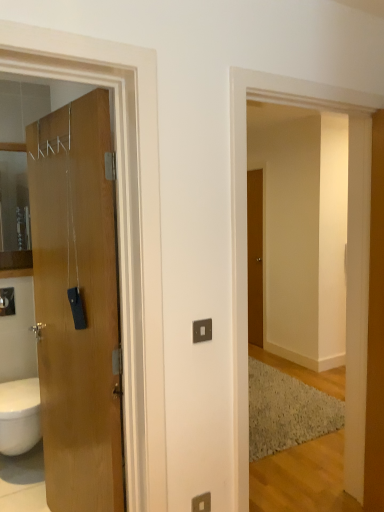
Question: Would you say wooden pillar at right contains wooden door at left, marked as the second door in a back-to-front arrangement?

Choices:
 (A) no
 (B) yes

Answer: (A)

Question: Is wooden pillar at right bigger than wooden door at left, marked as the second door in a back-to-front arrangement?

Choices:
 (A) no
 (B) yes

Answer: (A)

Question: Is wooden pillar at right smaller than wooden door at left, which is the 1th door in front-to-back order?

Choices:
 (A) no
 (B) yes

Answer: (B)

Question: From a real-world perspective, is wooden pillar at right on wooden door at left, which is the 1th door in front-to-back order?

Choices:
 (A) no
 (B) yes

Answer: (A)

Question: Is wooden pillar at right shorter than wooden door at left, arranged as the 1th door when viewed from the left?

Choices:
 (A) yes
 (B) no

Answer: (A)

Question: From a real-world perspective, relative to wooden door at left, arranged as the 1th door when viewed from the left, is wooden pillar at right vertically above or below?

Choices:
 (A) above
 (B) below

Answer: (B)

Question: Do you think wooden pillar at right is within wooden door at left, arranged as the 1th door when viewed from the left, or outside of it?

Choices:
 (A) outside
 (B) inside

Answer: (A)

Question: Is wooden pillar at right in front of or behind wooden door at left, the 2th door positioned from the right, in the image?

Choices:
 (A) front
 (B) behind

Answer: (B)

Question: From the image's perspective, is wooden pillar at right located above or below wooden door at left, which is the 1th door in front-to-back order?

Choices:
 (A) above
 (B) below

Answer: (A)

Question: Would you say wooden pillar at right is to the left or to the right of matte silver switch at lower center in the picture?

Choices:
 (A) left
 (B) right

Answer: (B)

Question: Is wooden pillar at right in front of or behind matte silver switch at lower center in the image?

Choices:
 (A) front
 (B) behind

Answer: (B)

Question: Considering the positions of point (357, 352) and point (210, 506), is point (357, 352) closer or farther from the camera than point (210, 506)?

Choices:
 (A) closer
 (B) farther

Answer: (B)

Question: Is wooden pillar at right situated inside matte silver switch at lower center or outside?

Choices:
 (A) inside
 (B) outside

Answer: (B)

Question: In terms of height, does brown wooden door at center, the second door positioned from the front, look taller or shorter compared to wooden door at left, which is the 1th door in front-to-back order?

Choices:
 (A) tall
 (B) short

Answer: (B)

Question: From a real-world perspective, is brown wooden door at center, arranged as the first door when viewed from the back, positioned above or below wooden door at left, which is the 1th door in front-to-back order?

Choices:
 (A) below
 (B) above

Answer: (B)